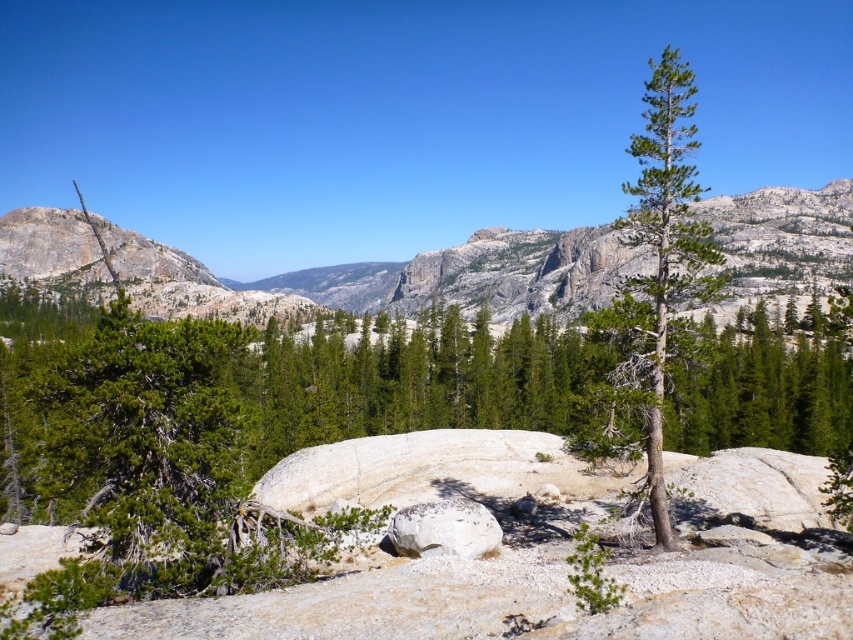
Can you confirm if green textured pine tree at center right is bigger than white speckled rock at center?

Yes.

Does green textured pine tree at center right lie behind white speckled rock at center?

No, it is in front of white speckled rock at center.

This screenshot has height=640, width=853. In order to click on green textured pine tree at center right in this screenshot , I will do `click(664, 250)`.

Where is `green textured pine tree at center right`? The height and width of the screenshot is (640, 853). green textured pine tree at center right is located at coordinates (664, 250).

Is point (51, 252) less distant than point (451, 552)?

No, (51, 252) is behind (451, 552).

Between granite rock formation at center and white speckled rock at center, which one has more height?

With more height is granite rock formation at center.

Is point (74, 221) in front of point (451, 512)?

That is False.

Identify the location of granite rock formation at center. (396, 275).

Which is in front, point (552, 307) or point (672, 156)?

Positioned in front is point (672, 156).

Between granite rock formation at center and green textured pine tree at center right, which one is positioned lower?

granite rock formation at center is lower down.

Which is behind, point (102, 266) or point (692, 109)?

The point (102, 266) is behind.

Image resolution: width=853 pixels, height=640 pixels. Find the location of `granite rock formation at center`. granite rock formation at center is located at coordinates (396, 275).